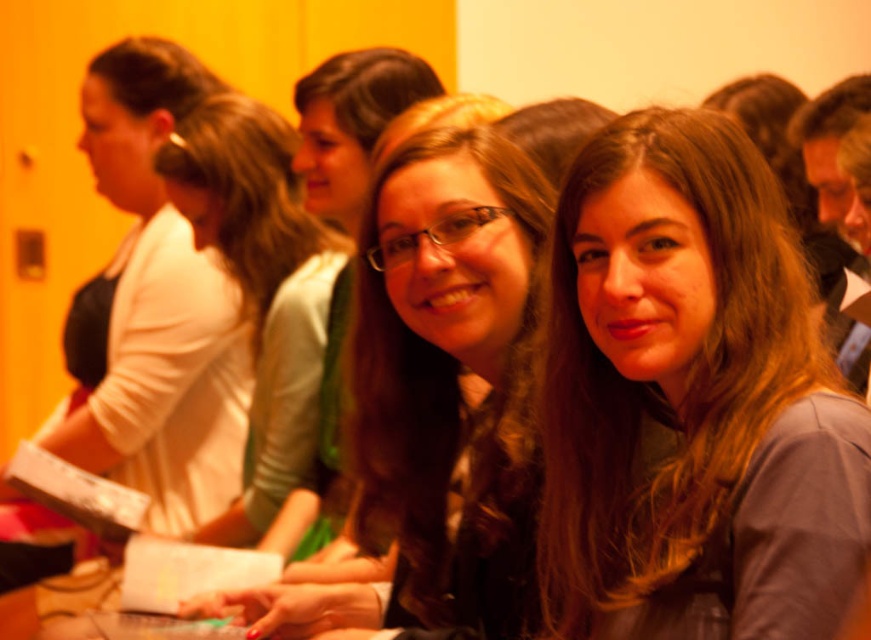
Question: Does brown hair at center lie behind white matte jacket at upper left?

Choices:
 (A) no
 (B) yes

Answer: (A)

Question: Which object appears closest to the camera in this image?

Choices:
 (A) white matte jacket at upper left
 (B) brown hair at center
 (C) matte black hair at center

Answer: (B)

Question: Which is farther from the white matte jacket at upper left?

Choices:
 (A) brown hair at center
 (B) matte black hair at center

Answer: (A)

Question: Which point is farther from the camera taking this photo?

Choices:
 (A) (106, 56)
 (B) (372, 397)

Answer: (A)

Question: Is matte black hair at center to the left of white matte jacket at upper left from the viewer's perspective?

Choices:
 (A) yes
 (B) no

Answer: (B)

Question: Can you confirm if brown hair at center is bigger than matte black hair at center?

Choices:
 (A) no
 (B) yes

Answer: (A)